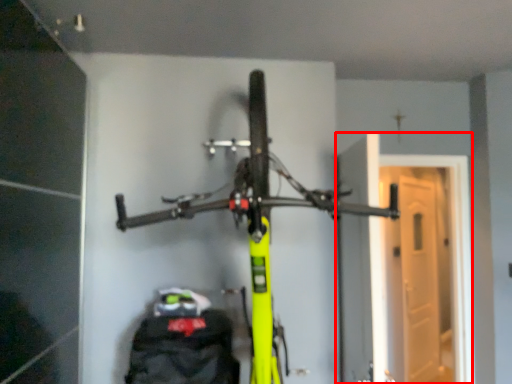
Question: In this image, where is garage door (annotated by the red box) located relative to bicycle?

Choices:
 (A) right
 (B) left

Answer: (A)